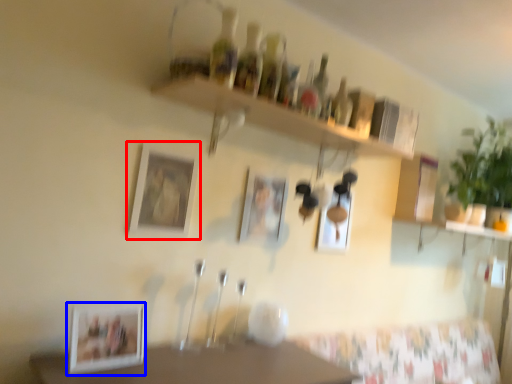
Question: Which of the following is the farthest to the observer, picture frame (highlighted by a red box) or picture frame (highlighted by a blue box)?

Choices:
 (A) picture frame
 (B) picture frame

Answer: (A)